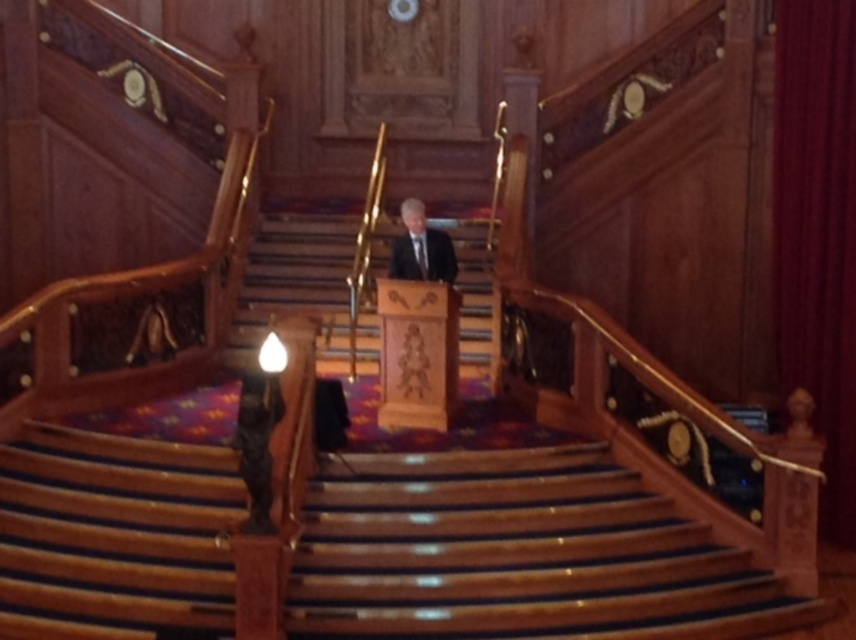
Question: Does dark red velvet curtain at upper center appear over dark suit at center?

Choices:
 (A) yes
 (B) no

Answer: (B)

Question: Does dark red velvet curtain at upper center have a smaller size compared to dark suit at center?

Choices:
 (A) no
 (B) yes

Answer: (A)

Question: Estimate the real-world distances between objects in this image. Which object is farther from the wooden stairs at center?

Choices:
 (A) wooden podium at center
 (B) dark suit at center

Answer: (A)

Question: Based on their relative distances, which object is nearer to the dark suit at center?

Choices:
 (A) wooden podium at center
 (B) dark red velvet curtain at upper center

Answer: (A)

Question: In this image, where is dark red velvet curtain at upper center located relative to wooden podium at center?

Choices:
 (A) left
 (B) right

Answer: (B)

Question: Which point is farther to the camera?

Choices:
 (A) dark red velvet curtain at upper center
 (B) wooden podium at center
 (C) wooden stairs at center
 (D) dark suit at center

Answer: (B)